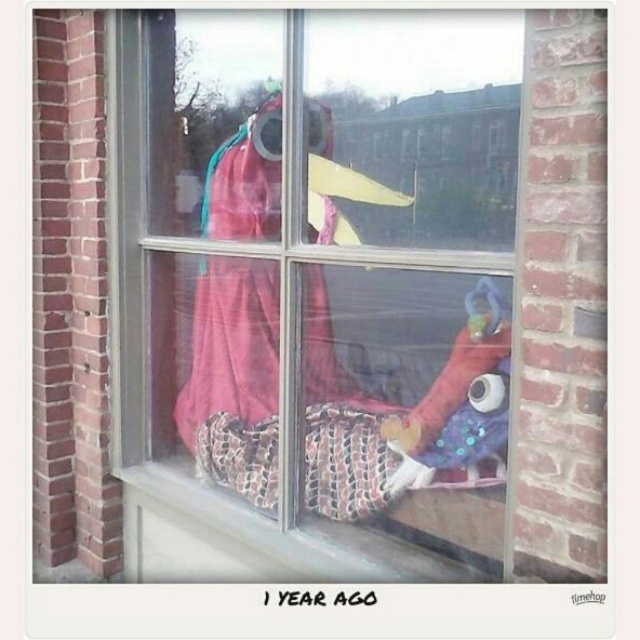
Between point (346, 572) and point (429, 401), which one is positioned in front?

Point (429, 401)

Locate an element on the screen. This screenshot has height=640, width=640. white textured stone at lower center is located at coordinates (259, 538).

Find the location of a particular element. The height and width of the screenshot is (640, 640). white textured stone at lower center is located at coordinates (259, 538).

I want to click on matte pink fabric at center, so click(x=314, y=282).

Between point (244, 467) and point (468, 294), which one is positioned behind?

Point (244, 467)

Is point (184, 493) positioned before point (435, 417)?

No, (184, 493) is further to viewer.

The height and width of the screenshot is (640, 640). I want to click on matte pink fabric at center, so click(314, 282).

Can you confirm if matte pink fabric at center is shorter than white textured stone at lower center?

No.

Between matte pink fabric at center and white textured stone at lower center, which one has less height?

white textured stone at lower center

Between point (124, 218) and point (481, 508), which one is positioned behind?

Positioned behind is point (124, 218).

Identify the location of matte pink fabric at center. (314, 282).